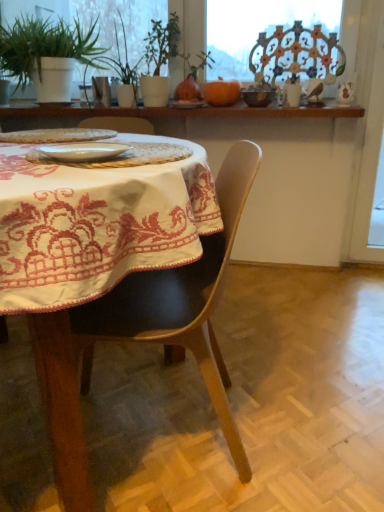
Question: In the image, is green leafy plant at upper center positioned in front of or behind white glossy plate at center, which is the 1th tableware from left to right?

Choices:
 (A) behind
 (B) front

Answer: (A)

Question: From the image's perspective, is green leafy plant at upper center above or below white glossy plate at center, which is counted as the second tableware, starting from the right?

Choices:
 (A) above
 (B) below

Answer: (A)

Question: Which of these objects is positioned farthest from the wooden shelf at upper center?

Choices:
 (A) orange matte pumpkin at upper center
 (B) black leather chair at center
 (C) white embroidered tablecloth at center
 (D) white glossy plate at center, which is the 1th tableware from left to right
 (E) matte brown bowl at upper center, acting as the second tableware starting from the front

Answer: (C)

Question: Estimate the real-world distances between objects in this image. Which object is farther from the white embroidered tablecloth at center?

Choices:
 (A) white glossy plate at center, which is counted as the second tableware, starting from the right
 (B) black leather chair at center
 (C) green leafy plant at upper center
 (D) wooden shelf at upper center
 (E) matte brown bowl at upper center, placed as the first tableware when sorted from right to left

Answer: (C)